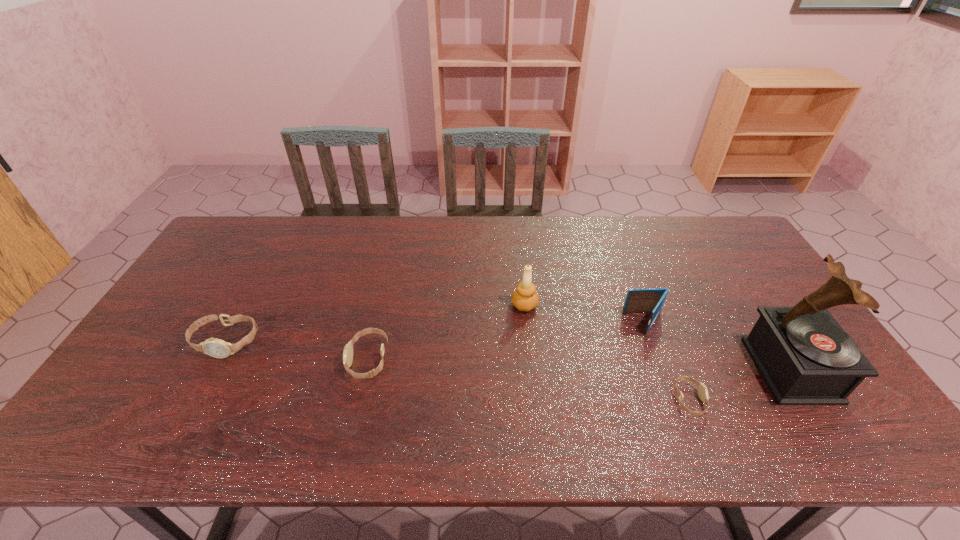
At what (x,y) coordinates should I click in order to perform the action: click on vacant area at the near left corner of the desktop. Please return your answer as a coordinate pair (x, y). This screenshot has width=960, height=540. Looking at the image, I should click on (136, 407).

The image size is (960, 540). What are the coordinates of `free spot at the far right corner of the desktop` in the screenshot? It's located at (706, 221).

At what (x,y) coordinates should I click in order to perform the action: click on vacant region between the phonograph_record and the third tallest object. Please return your answer as a coordinate pair (x, y). Looking at the image, I should click on (718, 346).

The width and height of the screenshot is (960, 540). I want to click on empty space between the fifth tallest object and the tallest object, so click(580, 364).

Identify the location of free point between the fifth shortest object and the wallet. [585, 314].

Locate an element on the screen. The image size is (960, 540). free area in between the second watch from right to left and the shortest watch is located at coordinates (529, 380).

What are the coordinates of `empty space between the third object from left to right and the second shortest watch` in the screenshot? It's located at (446, 332).

What are the coordinates of `vacant region between the leftmost object and the third object from left to right` in the screenshot? It's located at [x=375, y=323].

Image resolution: width=960 pixels, height=540 pixels. Find the location of `free point between the fourth shortest object and the leftmost watch`. free point between the fourth shortest object and the leftmost watch is located at coordinates (436, 332).

The height and width of the screenshot is (540, 960). What are the coordinates of `free space between the wallet and the fourth object from right to left` in the screenshot? It's located at 585,314.